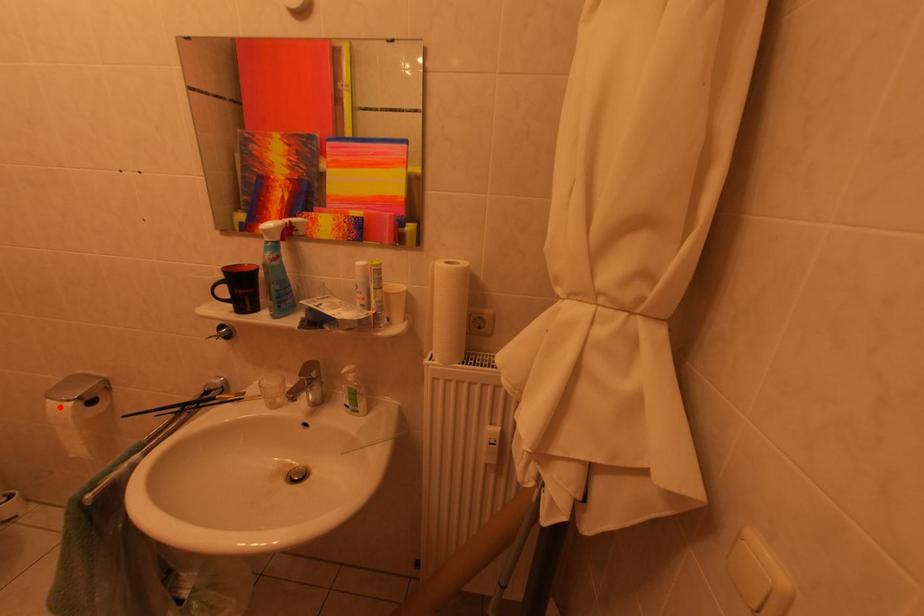
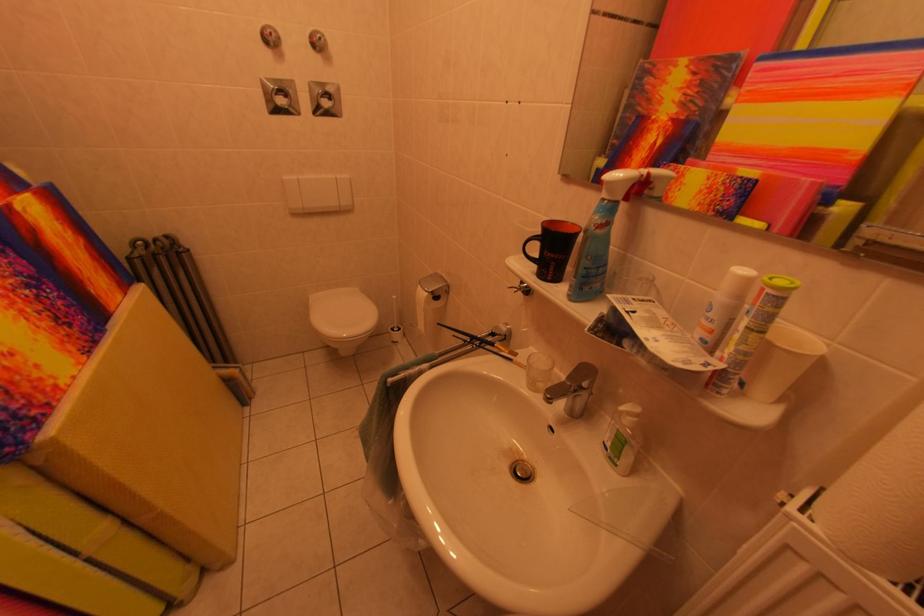
Question: I am providing you with two images of the same scene from different viewpoints. Image1 has a red point marked. In image2, the corresponding 3D location appears at what relative position? Reply with the corresponding letter.

Choices:
 (A) Closer
 (B) Farther

Answer: (B)